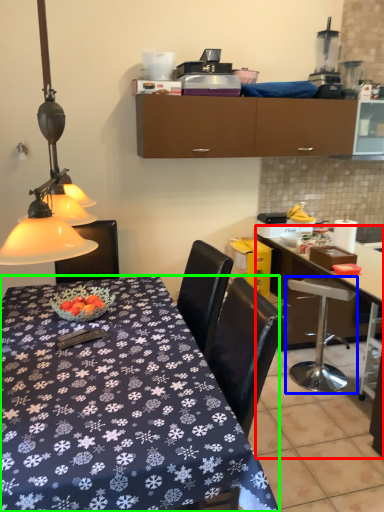
Question: Which object is the closest to the desk (highlighted by a red box)? Choose among these: chair (highlighted by a blue box) or desk (highlighted by a green box).

Choices:
 (A) chair
 (B) desk

Answer: (A)